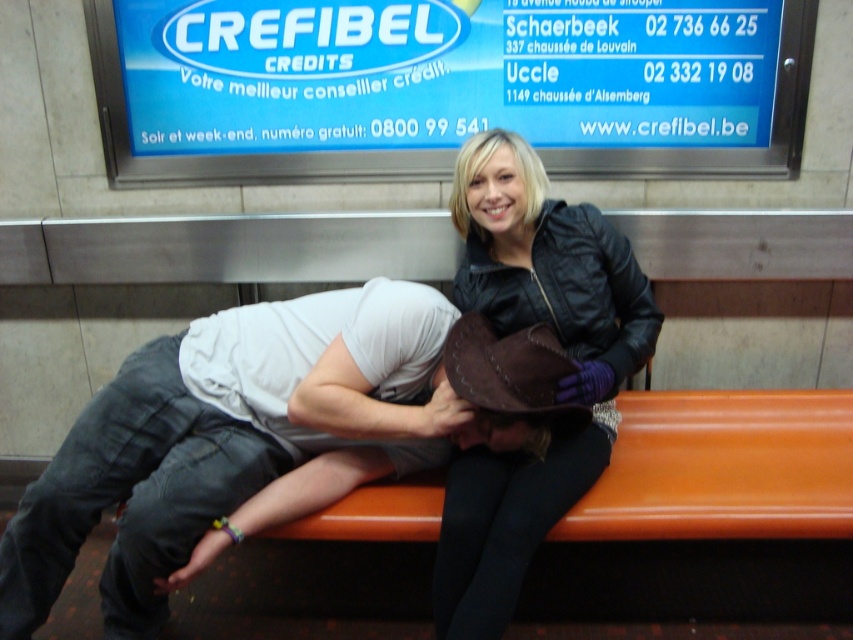
Question: In this image, where is gray cotton pants at left located relative to leather jacket at center?

Choices:
 (A) above
 (B) below

Answer: (B)

Question: Is gray cotton pants at left positioned at the back of leather jacket at center?

Choices:
 (A) yes
 (B) no

Answer: (A)

Question: Which object is closer to the camera taking this photo?

Choices:
 (A) leather jacket at center
 (B) gray cotton pants at left

Answer: (A)

Question: Is gray cotton pants at left closer to camera compared to leather jacket at center?

Choices:
 (A) yes
 (B) no

Answer: (B)